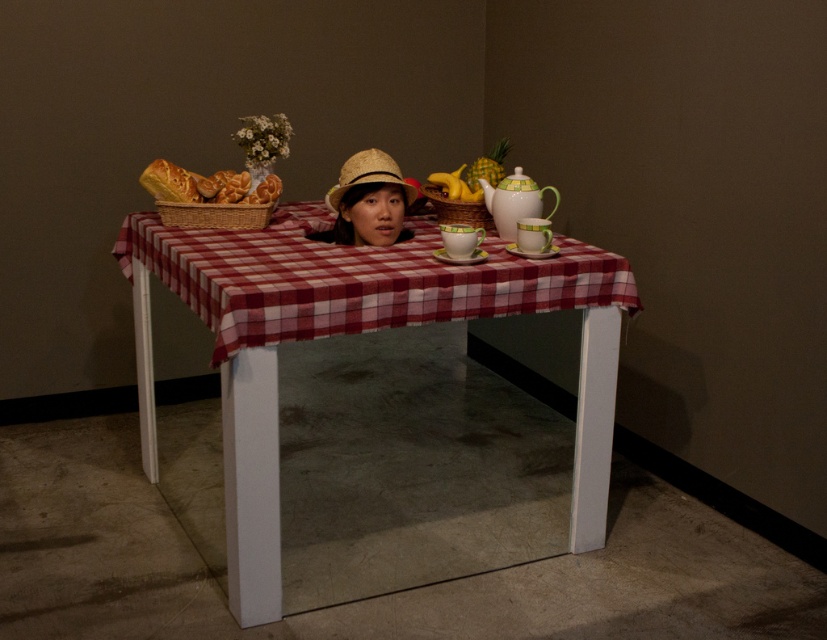
Question: Which object appears closest to the camera in this image?

Choices:
 (A) red checkered tablecloth at center
 (B) straw hat at center

Answer: (A)

Question: Does red checkered tablecloth at center come behind golden brown bread at left?

Choices:
 (A) no
 (B) yes

Answer: (A)

Question: Which of these objects is positioned farthest from the red checkered tablecloth at center?

Choices:
 (A) golden brown bread at left
 (B) straw hat at center

Answer: (B)

Question: Considering the real-world distances, which object is farthest from the golden brown bread at left?

Choices:
 (A) red checkered tablecloth at center
 (B) straw hat at center

Answer: (B)

Question: In this image, where is red checkered tablecloth at center located relative to golden brown bread at left?

Choices:
 (A) left
 (B) right

Answer: (B)

Question: Can you confirm if white glossy table at center is bigger than red checkered tablecloth at center?

Choices:
 (A) no
 (B) yes

Answer: (B)